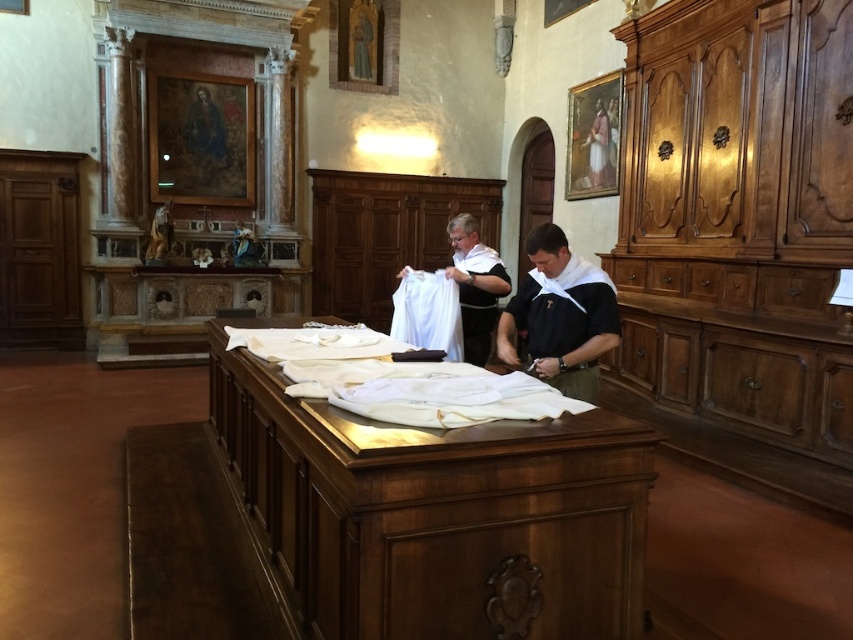
Can you confirm if black cotton shirt at center is positioned to the right of white cloth at center?

Yes, black cotton shirt at center is to the right of white cloth at center.

Can you confirm if black cotton shirt at center is shorter than white cloth at center?

Correct, black cotton shirt at center is not as tall as white cloth at center.

What do you see at coordinates (560, 316) in the screenshot? The height and width of the screenshot is (640, 853). I see `black cotton shirt at center` at bounding box center [560, 316].

The image size is (853, 640). What are the coordinates of `black cotton shirt at center` in the screenshot? It's located at (560, 316).

Is point (422, 532) closer to viewer compared to point (491, 264)?

Yes.

The width and height of the screenshot is (853, 640). Find the location of `wooden table at center`. wooden table at center is located at coordinates (437, 513).

Is wooden table at center to the left of black cotton shirt at center from the viewer's perspective?

Correct, you'll find wooden table at center to the left of black cotton shirt at center.

Is wooden table at center behind black cotton shirt at center?

No.

This screenshot has width=853, height=640. In order to click on wooden table at center in this screenshot , I will do `click(437, 513)`.